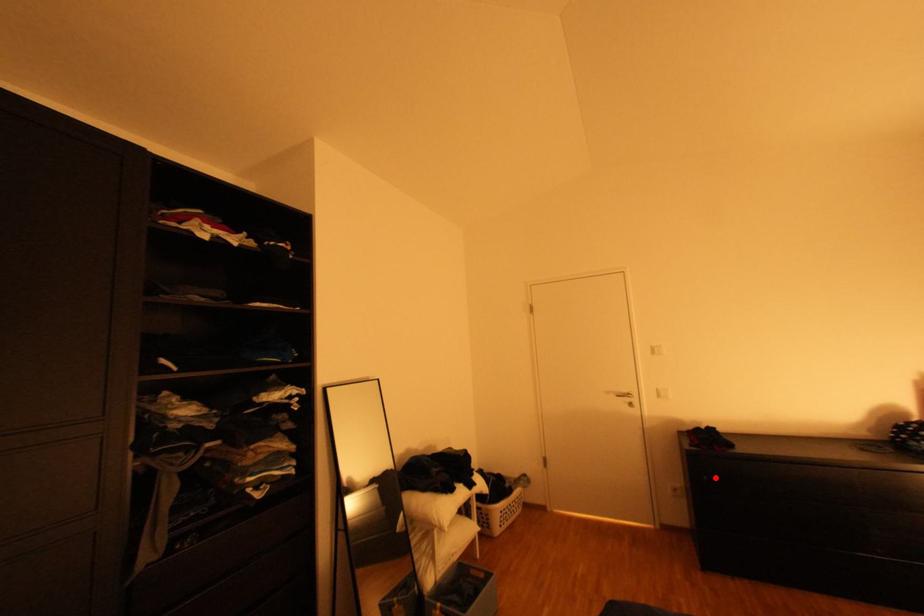
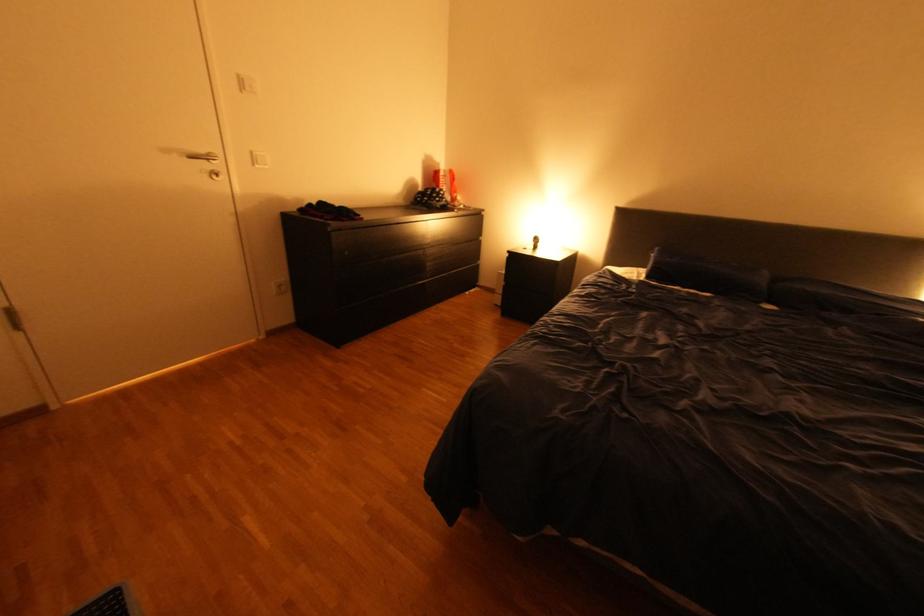
In the second image, find the point that corresponds to the highlighted location in the first image.

(357, 253)